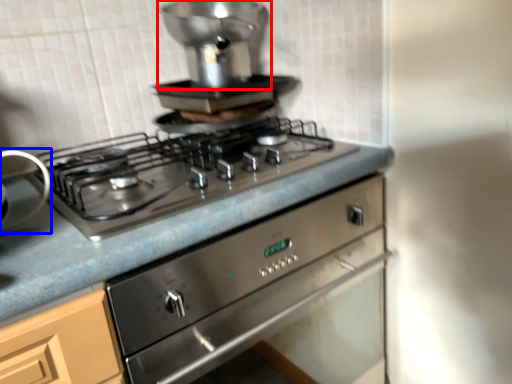
Question: Which object appears closest to the camera in this image, appliance (highlighted by a red box) or appliance (highlighted by a blue box)?

Choices:
 (A) appliance
 (B) appliance

Answer: (B)